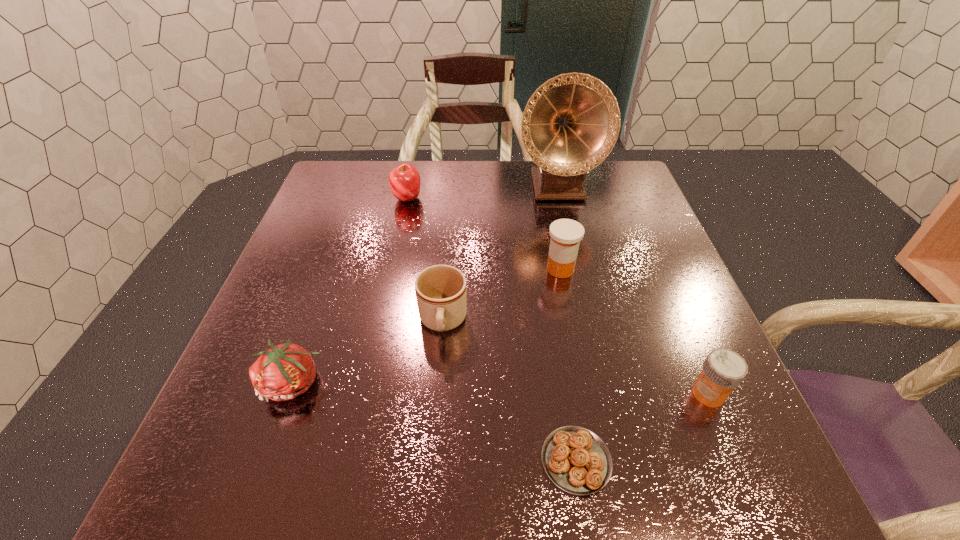
Image resolution: width=960 pixels, height=540 pixels. Identify the location of the nearest object. (575, 459).

The height and width of the screenshot is (540, 960). I want to click on vacant space located 0.260m on the horn of the phonograph record, so click(x=577, y=275).

What are the coordinates of `vacant region located on the label of the taller medicine` in the screenshot? It's located at (383, 269).

Find the location of `vacant space located 0.390m on the label of the taller medicine`. vacant space located 0.390m on the label of the taller medicine is located at coordinates (374, 269).

This screenshot has width=960, height=540. What are the coordinates of `vacant area located 0.300m on the label of the taller medicine` in the screenshot? It's located at (414, 269).

You are a GUI agent. You are given a task and a screenshot of the screen. Output one action in this format:
    pyautogui.click(x=<x>, y=<y>)
    Task: Click on the free spot located 0.210m on the front of the apple
    
    Given the screenshot: What is the action you would take?
    pyautogui.click(x=395, y=260)

I want to click on free location located 0.120m on the side of the third object from left to right with the handle, so click(436, 404).

Where is `vacant region located on the label side of the nearer medicine`? This screenshot has width=960, height=540. vacant region located on the label side of the nearer medicine is located at coordinates (612, 394).

Find the location of `vacant space located 0.250m on the label side of the nearer medicine`. vacant space located 0.250m on the label side of the nearer medicine is located at coordinates (550, 394).

Image resolution: width=960 pixels, height=540 pixels. Find the location of `free point located 0.190m on the label side of the nearer medicine`. free point located 0.190m on the label side of the nearer medicine is located at coordinates (585, 394).